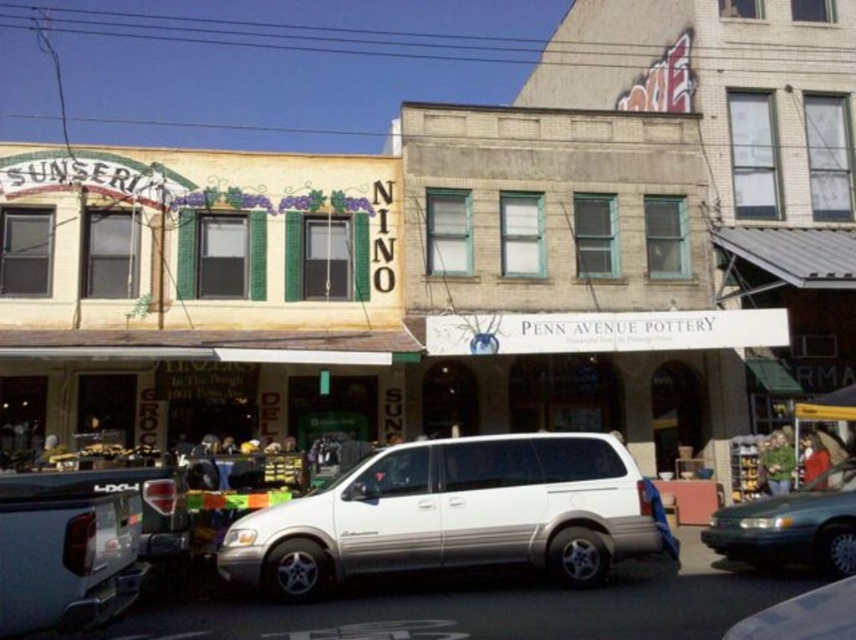
Question: Which point is closer to the camera?

Choices:
 (A) metallic silver van at center
 (B) green metallic sedan at lower right
 (C) white matte suv at center
 (D) silver metallic suv at lower left

Answer: (A)

Question: Which point is farther to the camera?

Choices:
 (A) green metallic sedan at lower right
 (B) white matte suv at center
 (C) metallic silver van at center

Answer: (A)

Question: Can you confirm if green metallic sedan at lower right is bigger than metallic silver van at center?

Choices:
 (A) no
 (B) yes

Answer: (B)

Question: Is green metallic sedan at lower right to the right of metallic silver van at center from the viewer's perspective?

Choices:
 (A) no
 (B) yes

Answer: (B)

Question: Can you confirm if silver metallic suv at lower left is bigger than green metallic sedan at lower right?

Choices:
 (A) no
 (B) yes

Answer: (A)

Question: Among these objects, which one is farthest from the camera?

Choices:
 (A) silver metallic suv at lower left
 (B) metallic silver van at center
 (C) white matte suv at center

Answer: (C)